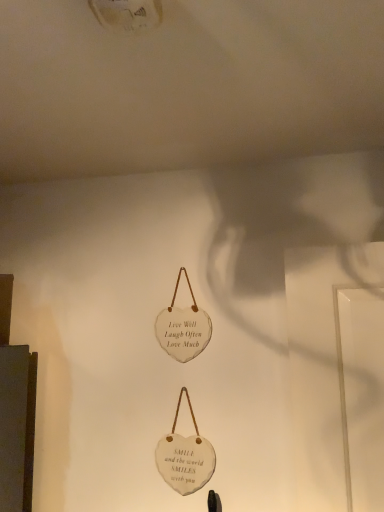
Question: Is white stone heart at center, the 2th handbag positioned from the bottom, not near white stone heart at center, the 2th handbag viewed from the top?

Choices:
 (A) no
 (B) yes

Answer: (A)

Question: Considering the relative positions of white stone heart at center, the 2th handbag positioned from the bottom, and white stone heart at center, arranged as the first handbag when ordered from the bottom, in the image provided, is white stone heart at center, the 2th handbag positioned from the bottom, in front of white stone heart at center, arranged as the first handbag when ordered from the bottom,?

Choices:
 (A) no
 (B) yes

Answer: (A)

Question: Does white stone heart at center, the 2th handbag positioned from the bottom, have a larger size compared to white stone heart at center, arranged as the first handbag when ordered from the bottom?

Choices:
 (A) no
 (B) yes

Answer: (B)

Question: Considering the relative positions of white stone heart at center, the 2th handbag positioned from the bottom, and white stone heart at center, arranged as the first handbag when ordered from the bottom, in the image provided, is white stone heart at center, the 2th handbag positioned from the bottom, to the right of white stone heart at center, arranged as the first handbag when ordered from the bottom, from the viewer's perspective?

Choices:
 (A) yes
 (B) no

Answer: (B)

Question: From the image's perspective, is white stone heart at center, the 2th handbag positioned from the bottom, under white stone heart at center, the 2th handbag viewed from the top?

Choices:
 (A) yes
 (B) no

Answer: (B)

Question: Would you say white stone heart at center, which is the first handbag in top-to-bottom order, is outside white stone heart at center, arranged as the first handbag when ordered from the bottom?

Choices:
 (A) yes
 (B) no

Answer: (A)

Question: Does white stone heart at center, the 2th handbag viewed from the top, have a lesser width compared to white stone heart at center, which is the first handbag in top-to-bottom order?

Choices:
 (A) yes
 (B) no

Answer: (A)

Question: Is white stone heart at center, which is the first handbag in top-to-bottom order, completely or partially inside white stone heart at center, the 2th handbag viewed from the top?

Choices:
 (A) yes
 (B) no

Answer: (B)

Question: Is white stone heart at center, which is the first handbag in top-to-bottom order, at the back of white stone heart at center, the 2th handbag viewed from the top?

Choices:
 (A) yes
 (B) no

Answer: (B)

Question: Is white stone heart at center, arranged as the first handbag when ordered from the bottom, beside white stone heart at center, which is the first handbag in top-to-bottom order?

Choices:
 (A) no
 (B) yes

Answer: (A)

Question: Can you confirm if white stone heart at center, the 2th handbag viewed from the top, is positioned to the left of white stone heart at center, the 2th handbag positioned from the bottom?

Choices:
 (A) yes
 (B) no

Answer: (B)

Question: From the image's perspective, is white stone heart at center, arranged as the first handbag when ordered from the bottom, over white stone heart at center, the 2th handbag positioned from the bottom?

Choices:
 (A) yes
 (B) no

Answer: (B)

Question: Is white stone heart at center, the 2th handbag positioned from the bottom, to the left or to the right of white stone heart at center, arranged as the first handbag when ordered from the bottom, in the image?

Choices:
 (A) right
 (B) left

Answer: (B)